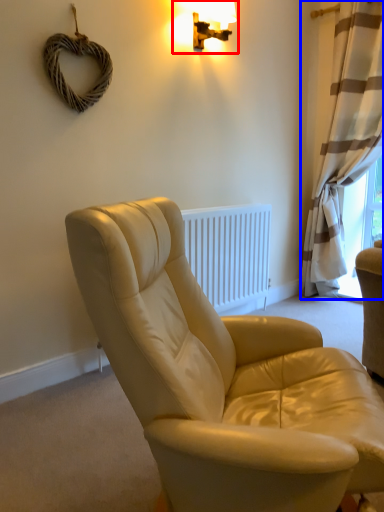
Question: Which object appears closest to the camera in this image, lamp (highlighted by a red box) or curtain (highlighted by a blue box)?

Choices:
 (A) lamp
 (B) curtain

Answer: (A)